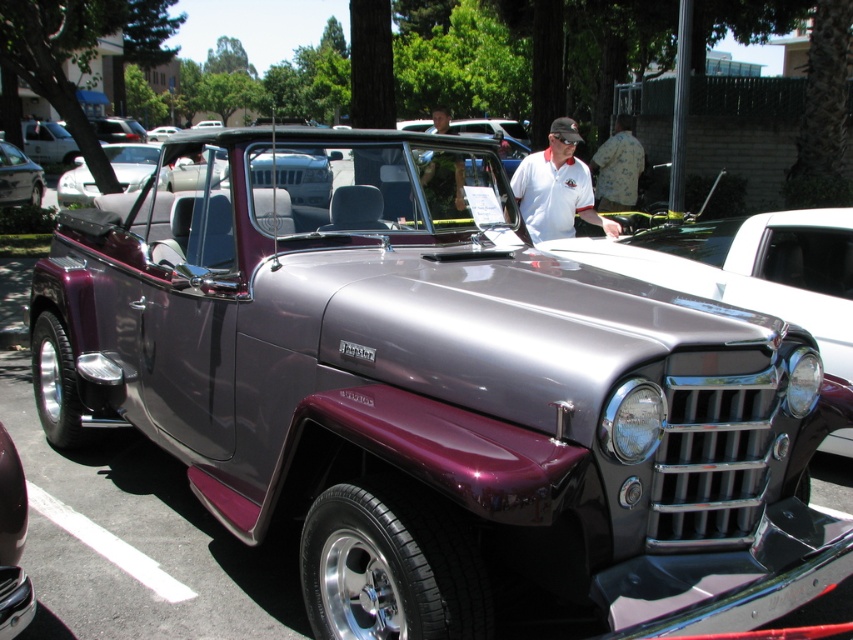
You are a photographer standing at the edge of the parking lot. You want to take a photo of the camouflage fabric shirt at center and the metallic silver car at center in the same frame. Given that your camera has a maximum focus range of 30 feet, will you be able to capture both subjects clearly in one shot?

The camouflage fabric shirt at center and metallic silver car at center are 34.91 feet apart. Since the distance exceeds the camera maximum focus range of 30 feet, you won,t be able to capture both subjects clearly in one shot.

You are standing in front of the vintage Jeep Willys and want to take a photo. You notice two points on the Jeep, one at point (x=461, y=193) and another at point (x=32, y=188). Which point will appear larger in your photo?

Point (x=461, y=193) will appear larger in the photo because it is closer to the camera than point (x=32, y=188).